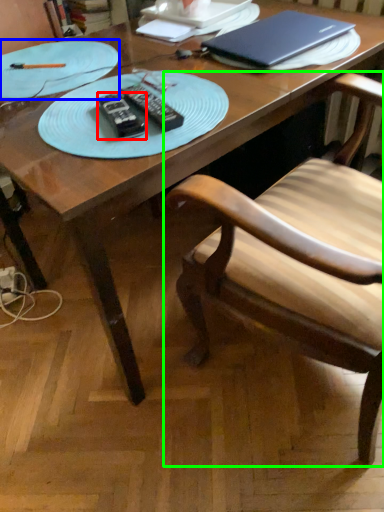
Question: Which is nearer to the remote (highlighted by a red box)? plate (highlighted by a blue box) or chair (highlighted by a green box).

Choices:
 (A) plate
 (B) chair

Answer: (A)